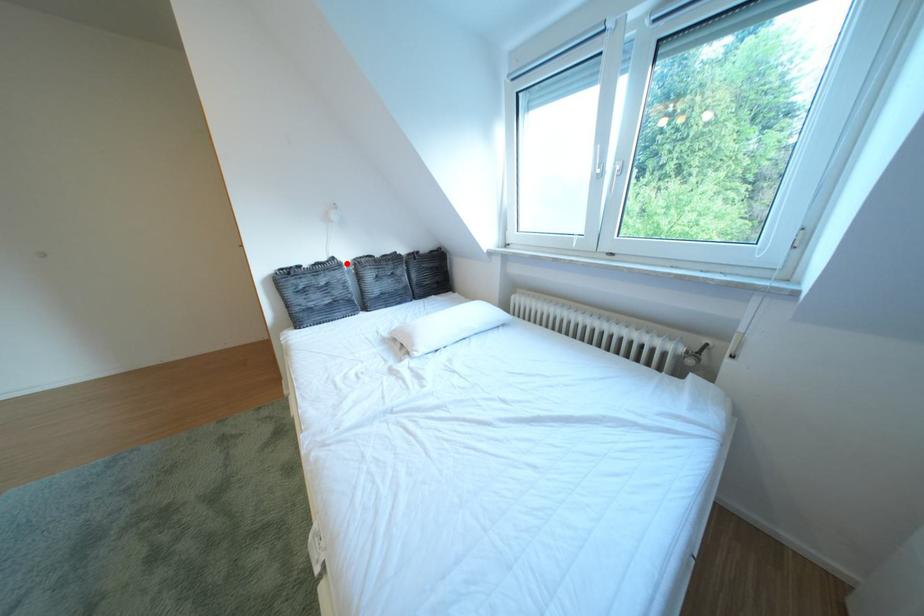
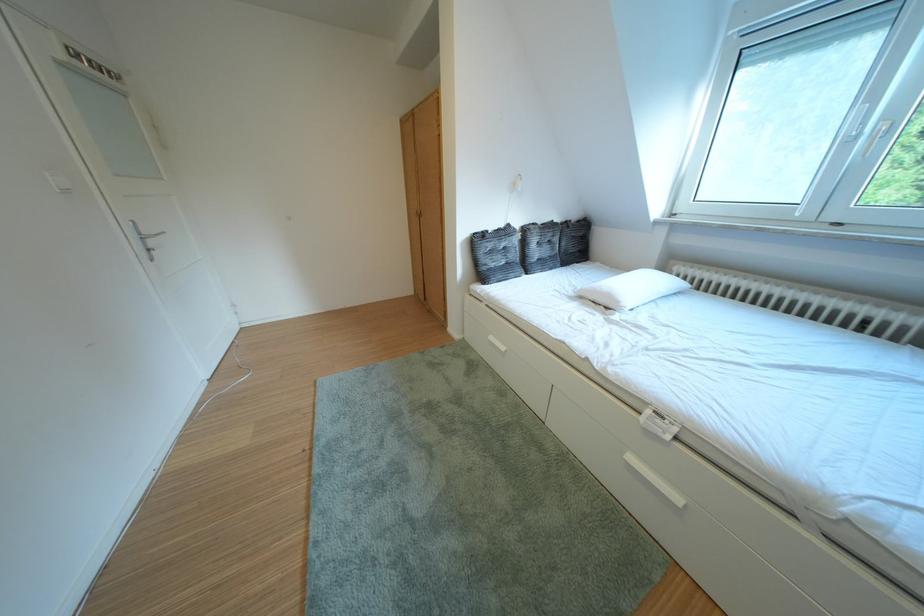
Find the pixel in the second image that matches the highlighted location in the first image.

(523, 230)